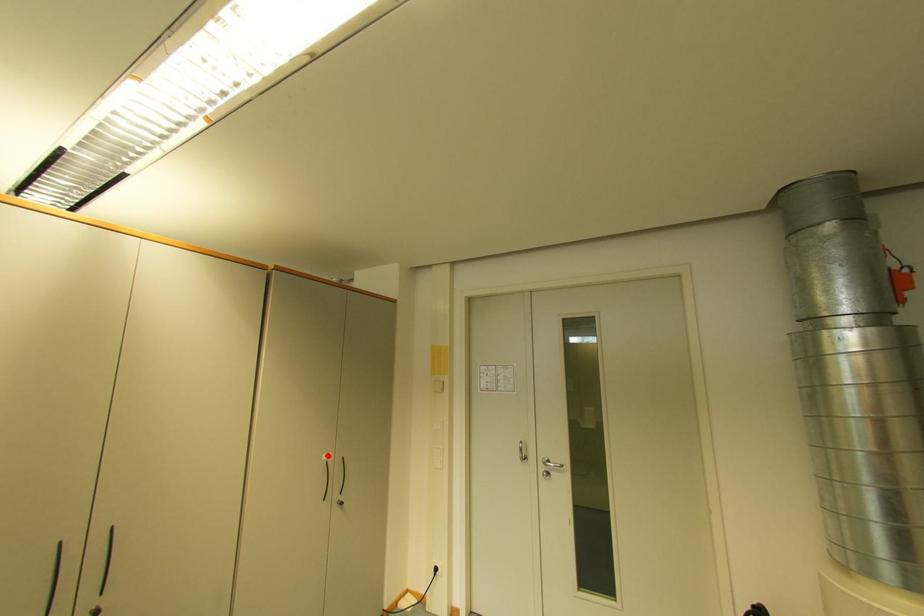
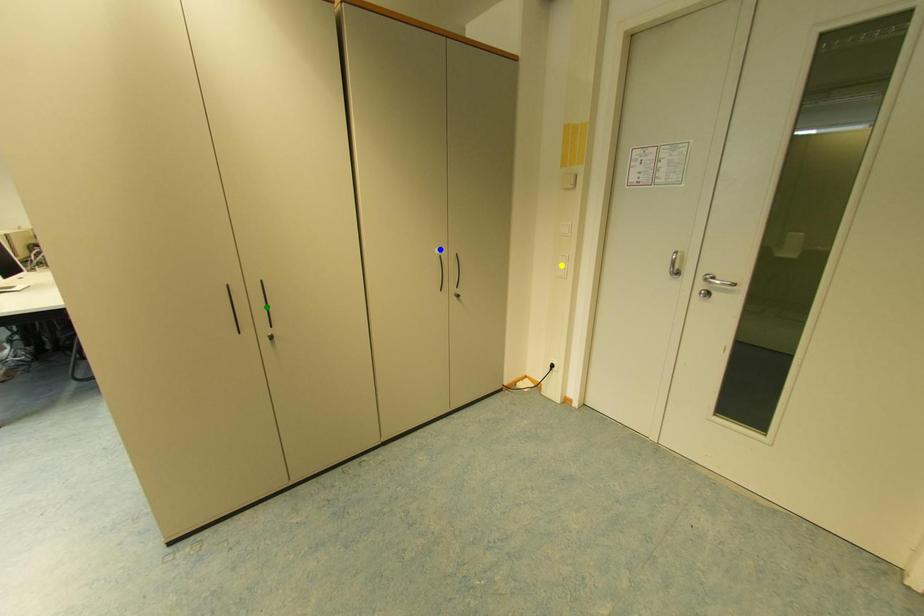
Question: I am providing you with two images of the same scene from different viewpoints. A red point is marked on the first image. You are given multiple points on the second image. Which mark in image 2 goes with the point in image 1?

Choices:
 (A) yellow point
 (B) green point
 (C) blue point

Answer: (C)